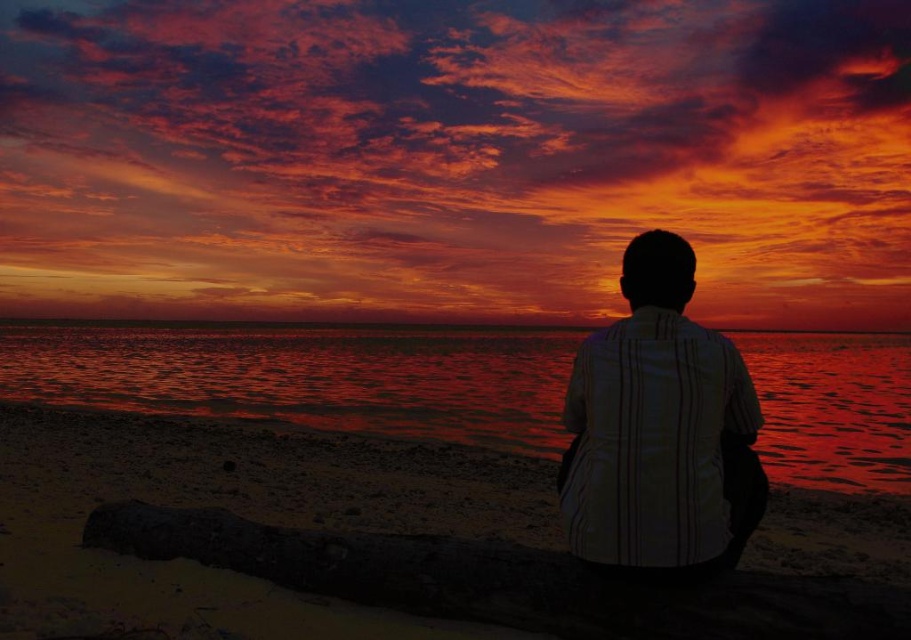
Can you confirm if smooth water at center is shorter than white striped shirt at center?

No, smooth water at center is not shorter than white striped shirt at center.

Which is below, smooth water at center or white striped shirt at center?

smooth water at center is lower down.

Between point (437, 420) and point (702, 387), which one is positioned in front?

Point (702, 387) is in front.

This screenshot has width=911, height=640. Find the location of `smooth water at center`. smooth water at center is located at coordinates (306, 376).

Is smooth sand beach at lower center wider than smooth water at center?

No.

Does smooth sand beach at lower center have a smaller size compared to smooth water at center?

Indeed, smooth sand beach at lower center has a smaller size compared to smooth water at center.

Does point (297, 568) come closer to viewer compared to point (275, 355)?

Yes, point (297, 568) is in front of point (275, 355).

At what (x,y) coordinates should I click in order to perform the action: click on smooth sand beach at lower center. Please return your answer as a coordinate pair (x, y). This screenshot has width=911, height=640. Looking at the image, I should click on (441, 529).

Is smooth sand beach at lower center below white striped shirt at center?

Yes, smooth sand beach at lower center is below white striped shirt at center.

Is point (826, 627) positioned in front of point (735, 509)?

That is True.

Describe the element at coordinates (441, 529) in the screenshot. I see `smooth sand beach at lower center` at that location.

At what (x,y) coordinates should I click in order to perform the action: click on smooth sand beach at lower center. Please return your answer as a coordinate pair (x, y). The width and height of the screenshot is (911, 640). Looking at the image, I should click on point(441,529).